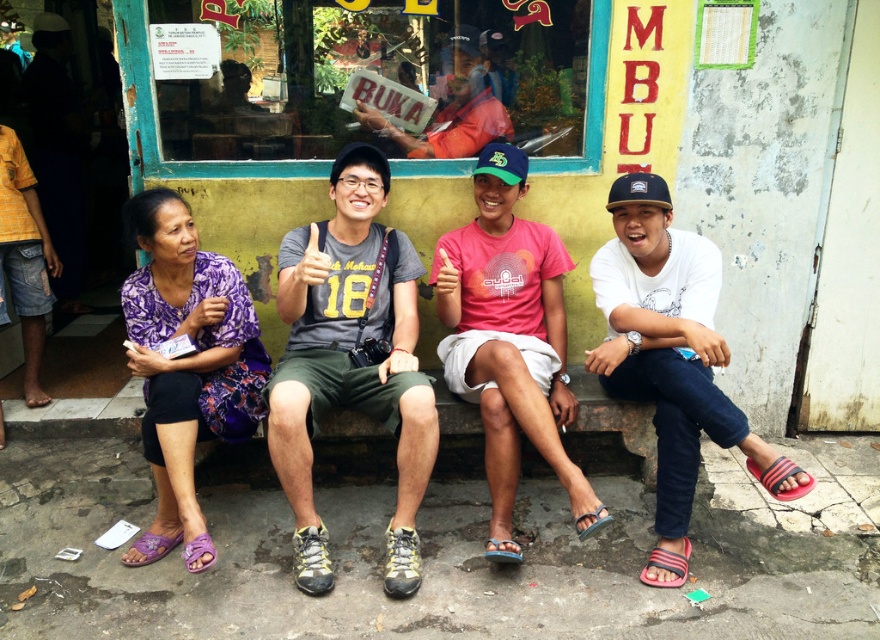
You are a photographer standing at a certain position. You want to take a photo of the white cotton shirt at center without including any other people in the frame. Is it possible based on the given information?

The white cotton shirt at center is 2.40 meters away from the camera. Since the distance is specified but no information about the positions of other people relative to it is provided, it is unclear if adjusting the camera angle or zoom could exclude others. The answer cannot be determined with certainty based on the given data.

You are a photographer trying to capture a group photo of the individuals on the stone bench. The two men in the white cotton shirt at center and pink cotton shirt at center are standing close to each other. To ensure both shirts are clearly visible, which shirt should you focus on first?

The white cotton shirt at center is larger in size than the pink cotton shirt at center, so focusing on the white cotton shirt at center first would ensure both shirts are clearly visible.